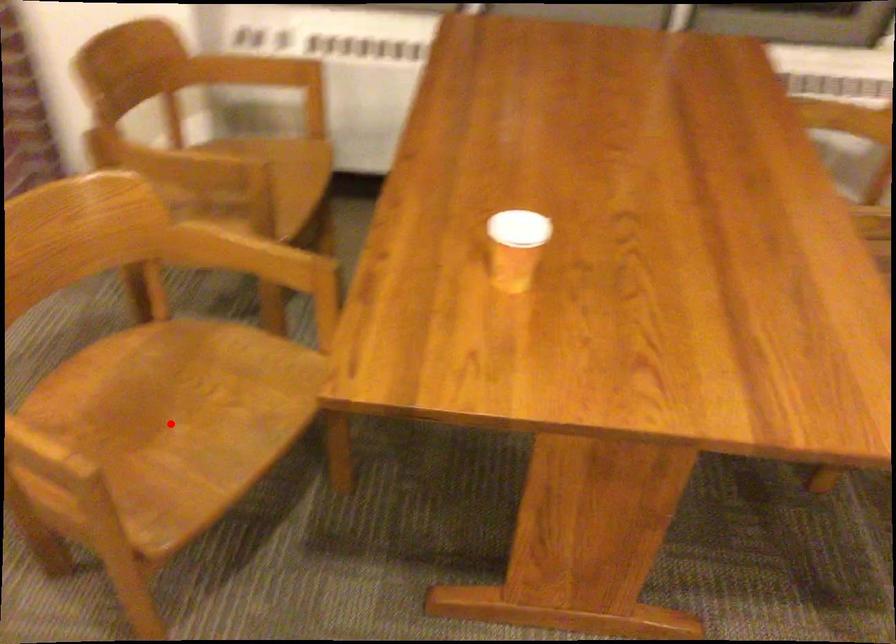
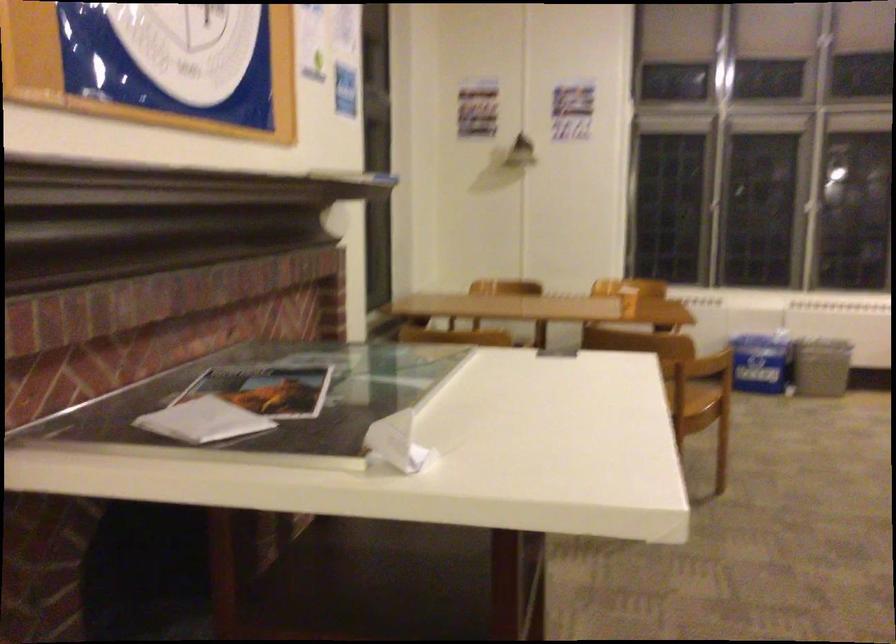
Question: I am providing you with two images of the same scene from different viewpoints. A red point is marked on the first image. Can you still see the location of the red point in image 2?

Choices:
 (A) Yes
 (B) No

Answer: (B)